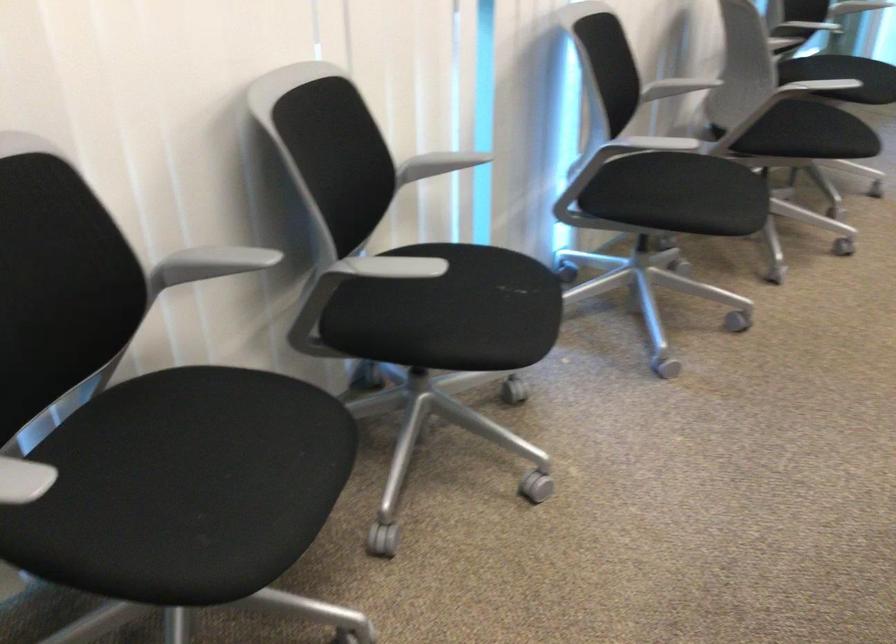
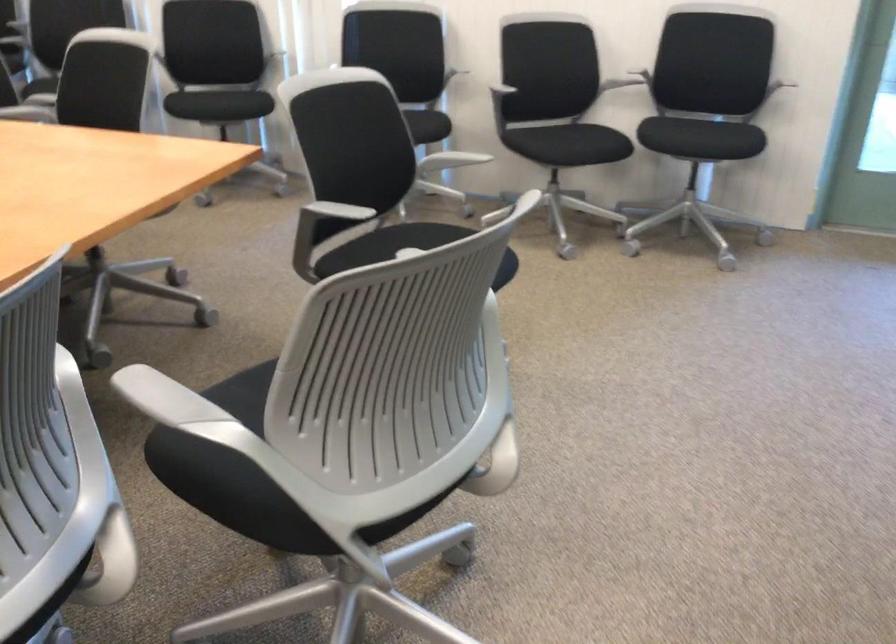
In the second image, find the point that corresponds to point (821, 122) in the first image.

(579, 144)